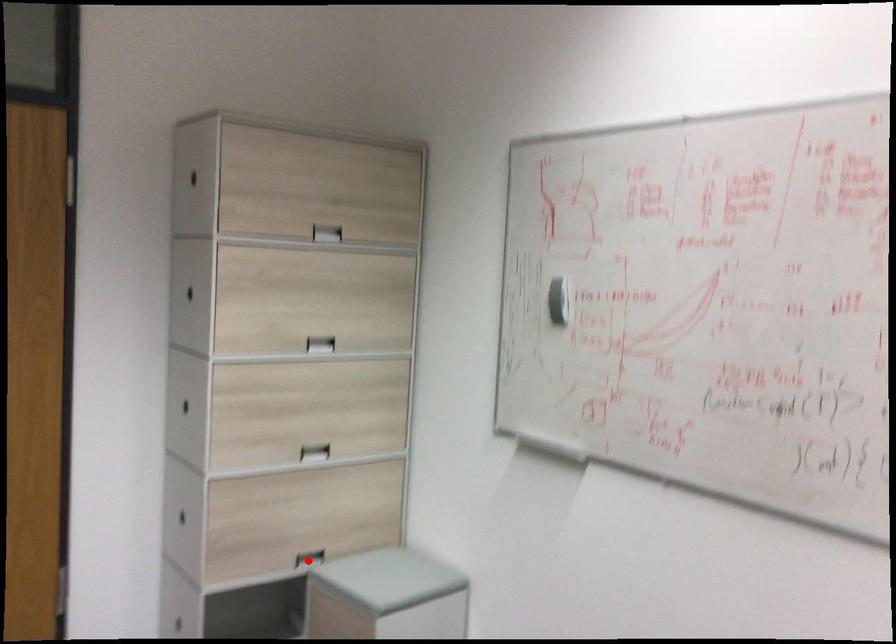
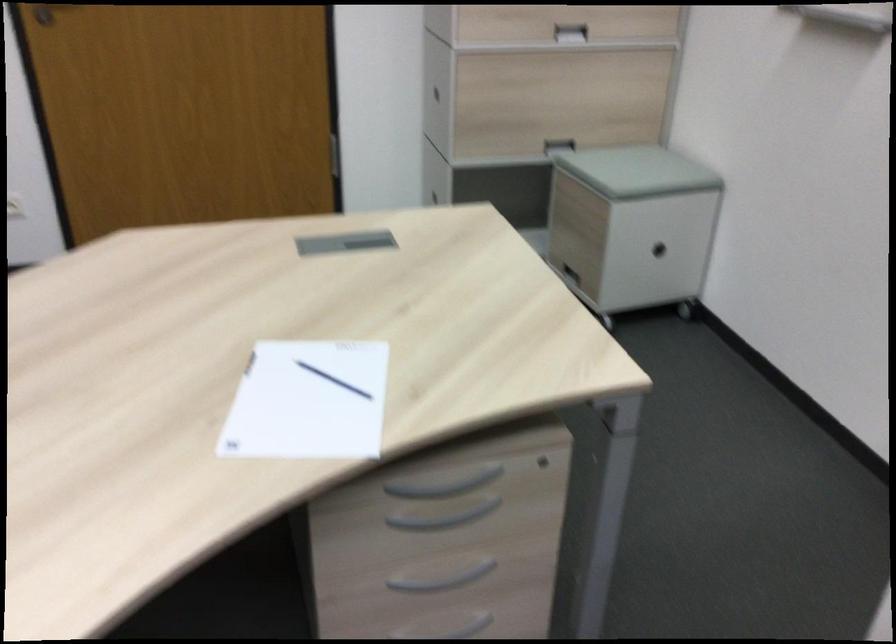
Find the pixel in the second image that matches the highlighted location in the first image.

(557, 146)